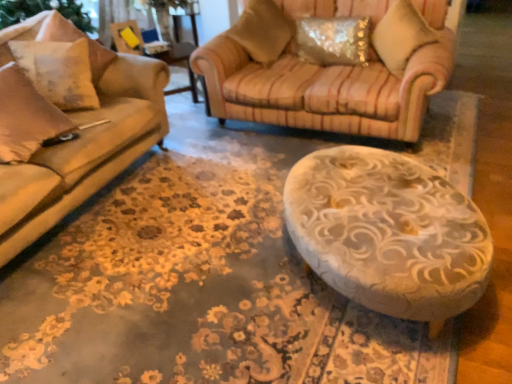
Question: Is sparkly metallic pillow at upper right, the 3th pillow in the left-to-right sequence, positioned beyond the bounds of textured beige pillow at upper center, the 2th pillow viewed from the left?

Choices:
 (A) yes
 (B) no

Answer: (A)

Question: Considering the relative sizes of sparkly metallic pillow at upper right, which is counted as the second pillow, starting from the right, and textured beige pillow at upper center, the 2th pillow viewed from the left, in the image provided, is sparkly metallic pillow at upper right, which is counted as the second pillow, starting from the right, bigger than textured beige pillow at upper center, the 2th pillow viewed from the left,?

Choices:
 (A) yes
 (B) no

Answer: (B)

Question: Could you tell me if sparkly metallic pillow at upper right, which is counted as the second pillow, starting from the right, is turned towards textured beige pillow at upper center, acting as the third pillow starting from the right?

Choices:
 (A) no
 (B) yes

Answer: (A)

Question: From a real-world perspective, is sparkly metallic pillow at upper right, which is counted as the second pillow, starting from the right, on top of textured beige pillow at upper center, the 2th pillow viewed from the left?

Choices:
 (A) no
 (B) yes

Answer: (A)

Question: Considering the relative sizes of sparkly metallic pillow at upper right, which is counted as the second pillow, starting from the right, and textured beige pillow at upper center, acting as the third pillow starting from the right, in the image provided, is sparkly metallic pillow at upper right, which is counted as the second pillow, starting from the right, shorter than textured beige pillow at upper center, acting as the third pillow starting from the right,?

Choices:
 (A) no
 (B) yes

Answer: (B)

Question: Is white textured pillow at left, which is the 4th pillow in right-to-left order, wider or thinner than textured beige pillow at upper center, the 2th pillow viewed from the left?

Choices:
 (A) thin
 (B) wide

Answer: (A)

Question: Visually, is white textured pillow at left, which is the 4th pillow in right-to-left order, positioned to the left or to the right of textured beige pillow at upper center, acting as the third pillow starting from the right?

Choices:
 (A) right
 (B) left

Answer: (B)

Question: Do you think white textured pillow at left, arranged as the 1th pillow when viewed from the left, is within textured beige pillow at upper center, the 2th pillow viewed from the left, or outside of it?

Choices:
 (A) inside
 (B) outside

Answer: (B)

Question: Based on their sizes in the image, would you say white textured pillow at left, arranged as the 1th pillow when viewed from the left, is bigger or smaller than textured beige pillow at upper center, the 2th pillow viewed from the left?

Choices:
 (A) small
 (B) big

Answer: (A)

Question: Is yellow plastic swivel chair at upper left in front of or behind textured beige pillow at upper center, acting as the third pillow starting from the right, in the image?

Choices:
 (A) behind
 (B) front

Answer: (A)

Question: Considering the positions of point (129, 49) and point (259, 8), is point (129, 49) closer or farther from the camera than point (259, 8)?

Choices:
 (A) farther
 (B) closer

Answer: (A)

Question: Is yellow plastic swivel chair at upper left bigger or smaller than textured beige pillow at upper center, acting as the third pillow starting from the right?

Choices:
 (A) big
 (B) small

Answer: (B)

Question: From the image's perspective, relative to textured beige pillow at upper center, the 2th pillow viewed from the left, is yellow plastic swivel chair at upper left above or below?

Choices:
 (A) below
 (B) above

Answer: (A)

Question: Is sparkly metallic pillow at upper right, which is counted as the second pillow, starting from the right, inside or outside of white textured pillow at left, which is the 4th pillow in right-to-left order?

Choices:
 (A) outside
 (B) inside

Answer: (A)

Question: From a real-world perspective, is sparkly metallic pillow at upper right, the 3th pillow in the left-to-right sequence, physically located above or below white textured pillow at left, arranged as the 1th pillow when viewed from the left?

Choices:
 (A) above
 (B) below

Answer: (B)